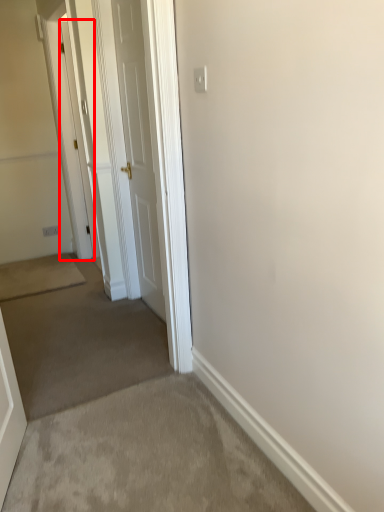
Question: From the image's perspective, considering the relative positions of door (annotated by the red box) and door in the image provided, where is door (annotated by the red box) located with respect to the staircase?

Choices:
 (A) below
 (B) above

Answer: (B)